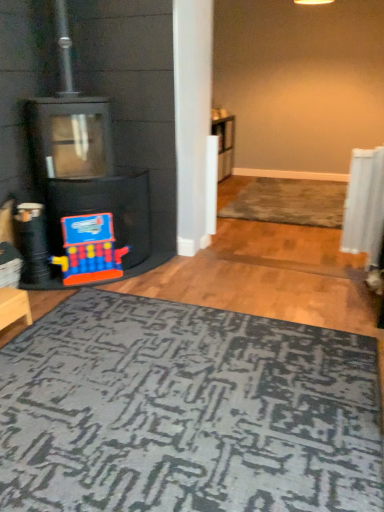
The image size is (384, 512). I want to click on free point below wooden stool at lower left (from a real-world perspective), so click(x=11, y=329).